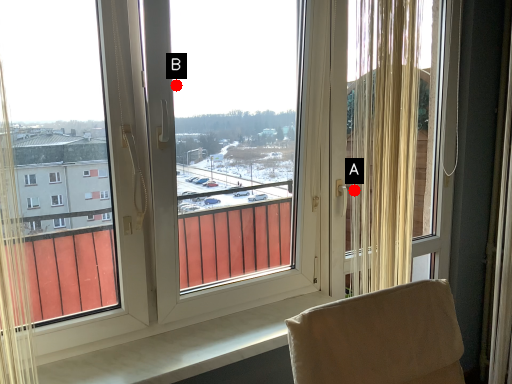
Question: Two points are circled on the image, labeled by A and B beside each circle. Among these points, which one is farthest from the camera?

Choices:
 (A) A is further
 (B) B is further

Answer: (B)